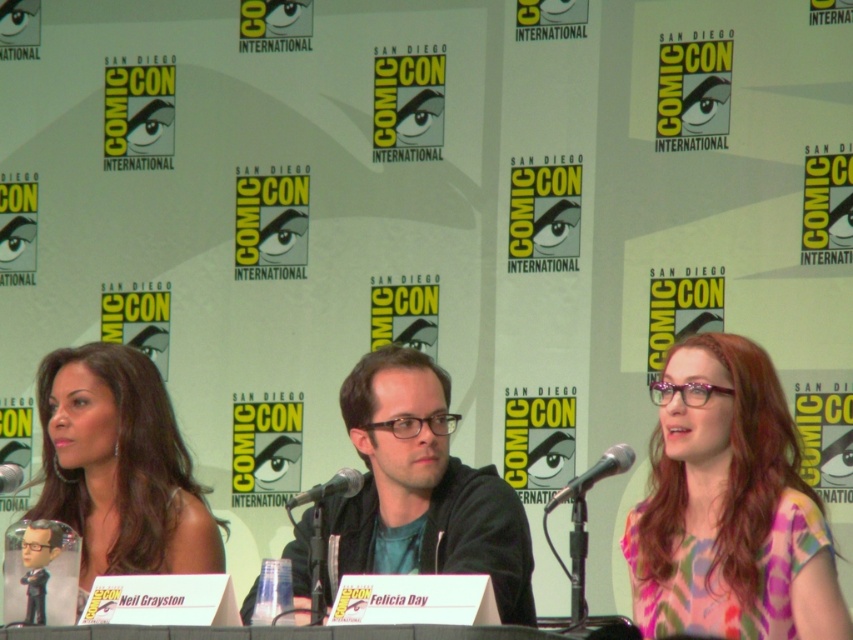
Is metallic silver microphone at center below black plastic microphone at center?

Actually, metallic silver microphone at center is above black plastic microphone at center.

Can you confirm if metallic silver microphone at center is wider than black plastic microphone at center?

No, metallic silver microphone at center is not wider than black plastic microphone at center.

Is point (578, 496) farther from viewer compared to point (0, 474)?

No, it is not.

At what (x,y) coordinates should I click in order to perform the action: click on metallic silver microphone at center. Please return your answer as a coordinate pair (x, y). Looking at the image, I should click on (595, 474).

Measure the distance between shiny black hair at left and camera.

They are 28.84 meters apart.

Is shiny black hair at left below black plastic microphone at center?

Incorrect, shiny black hair at left is not positioned below black plastic microphone at center.

Image resolution: width=853 pixels, height=640 pixels. What do you see at coordinates (119, 467) in the screenshot?
I see `shiny black hair at left` at bounding box center [119, 467].

Find the location of `shiny black hair at left`. shiny black hair at left is located at coordinates (119, 467).

Does point (190, 541) lie in front of point (297, 502)?

No, (190, 541) is further to viewer.

Measure the distance between shiny black hair at left and camera.

shiny black hair at left is 28.84 meters away from camera.

Find the location of a particular element. The image size is (853, 640). shiny black hair at left is located at coordinates (119, 467).